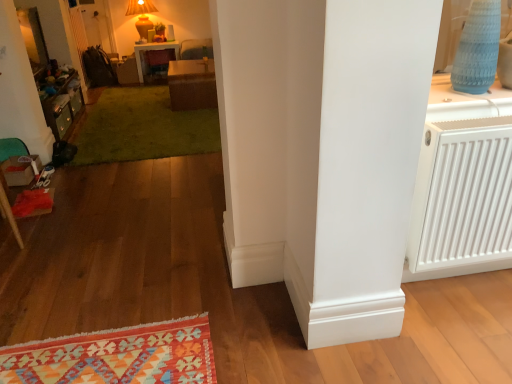
Question: From the image's perspective, does green plush rug at center appear higher than white plastic radiator at right?

Choices:
 (A) yes
 (B) no

Answer: (A)

Question: Does green plush rug at center have a greater height compared to white plastic radiator at right?

Choices:
 (A) no
 (B) yes

Answer: (A)

Question: Is the position of green plush rug at center more distant than that of white plastic radiator at right?

Choices:
 (A) yes
 (B) no

Answer: (A)

Question: From the image's perspective, is green plush rug at center located beneath white plastic radiator at right?

Choices:
 (A) yes
 (B) no

Answer: (B)

Question: From a real-world perspective, is green plush rug at center located beneath white plastic radiator at right?

Choices:
 (A) no
 (B) yes

Answer: (B)

Question: Can you confirm if green plush rug at center is shorter than white plastic radiator at right?

Choices:
 (A) yes
 (B) no

Answer: (A)

Question: Considering the relative sizes of matte yellow lamp at upper center and white plastic radiator at right in the image provided, is matte yellow lamp at upper center thinner than white plastic radiator at right?

Choices:
 (A) yes
 (B) no

Answer: (B)

Question: Is matte yellow lamp at upper center touching white plastic radiator at right?

Choices:
 (A) no
 (B) yes

Answer: (A)

Question: Does matte yellow lamp at upper center have a greater width compared to white plastic radiator at right?

Choices:
 (A) no
 (B) yes

Answer: (B)

Question: Is matte yellow lamp at upper center further to the viewer compared to white plastic radiator at right?

Choices:
 (A) no
 (B) yes

Answer: (B)

Question: Considering the relative sizes of matte yellow lamp at upper center and white plastic radiator at right in the image provided, is matte yellow lamp at upper center smaller than white plastic radiator at right?

Choices:
 (A) no
 (B) yes

Answer: (A)

Question: Are matte yellow lamp at upper center and white plastic radiator at right located far from each other?

Choices:
 (A) yes
 (B) no

Answer: (A)

Question: From a real-world perspective, is brown woven table at center, which is counted as the second table, starting from the back, positioned over matte yellow lamp at upper center based on gravity?

Choices:
 (A) yes
 (B) no

Answer: (B)